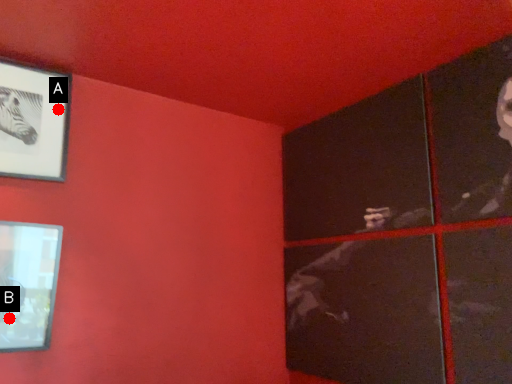
Question: Two points are circled on the image, labeled by A and B beside each circle. Which point is closer to the camera?

Choices:
 (A) A is closer
 (B) B is closer

Answer: (B)